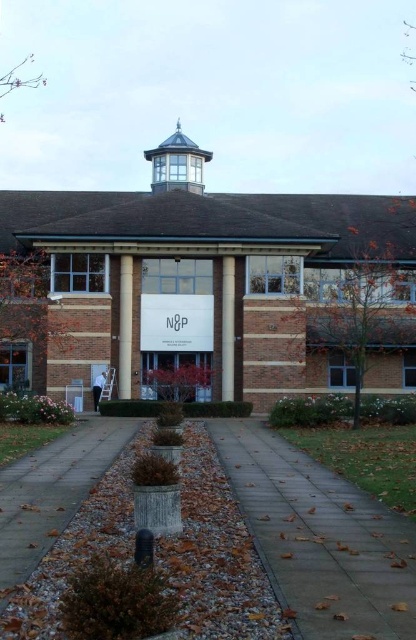
Can you confirm if brown brick building at center is positioned above gray concrete pavement at lower center?

Correct, brown brick building at center is located above gray concrete pavement at lower center.

Is brown brick building at center wider than gray concrete pavement at lower center?

Yes, brown brick building at center is wider than gray concrete pavement at lower center.

At what (x,y) coordinates should I click in order to perform the action: click on brown brick building at center. Please return your answer as a coordinate pair (x, y). Looking at the image, I should click on (220, 282).

How far apart are brown wood pillar at left and white concrete pillar at center?

A distance of 4.91 meters exists between brown wood pillar at left and white concrete pillar at center.

Who is taller, brown wood pillar at left or white concrete pillar at center?

brown wood pillar at left

Locate an element on the screen. brown wood pillar at left is located at coordinates (124, 326).

The height and width of the screenshot is (640, 416). In order to click on brown wood pillar at left in this screenshot , I will do `click(124, 326)`.

Who is lower down, gray concrete pavement at lower center or brown wood pillar at left?

gray concrete pavement at lower center is below.

Does point (354, 596) come in front of point (128, 262)?

Yes, it is.

Locate an element on the screen. gray concrete pavement at lower center is located at coordinates click(x=319, y=538).